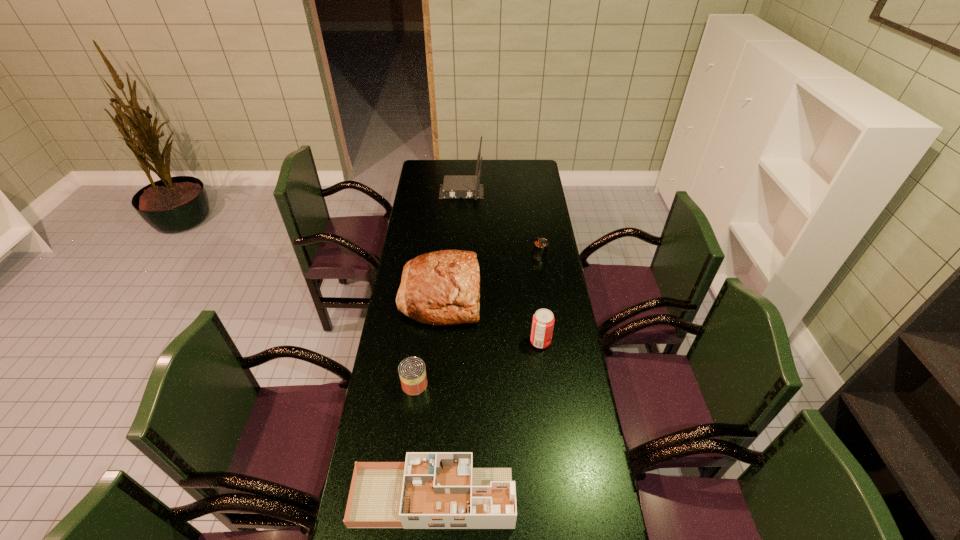
Where is `dollhouse that is at the left edge`? dollhouse that is at the left edge is located at coordinates (431, 490).

Identify the location of can present at the left edge. (412, 372).

Where is `soda can that is positioned at the right edge`? soda can that is positioned at the right edge is located at coordinates (543, 320).

The image size is (960, 540). Identify the location of can situated at the right edge. (540, 249).

I want to click on object present at the far left corner, so click(468, 187).

Find the location of a particular element. This screenshot has width=960, height=540. vacant area at the left edge of the desktop is located at coordinates (406, 260).

You are a GUI agent. You are given a task and a screenshot of the screen. Output one action in this format:
    pyautogui.click(x=<x>, y=<y>)
    Task: Click on the vacant space at the right edge
    The width and height of the screenshot is (960, 540).
    Given the screenshot: What is the action you would take?
    pyautogui.click(x=531, y=190)

You are a GUI agent. You are given a task and a screenshot of the screen. Output one action in this format:
    pyautogui.click(x=<x>, y=<y>)
    Task: Click on the vacant space at the far left corner of the desktop
    This screenshot has height=540, width=960.
    Given the screenshot: What is the action you would take?
    pyautogui.click(x=433, y=171)

Identify the location of free space between the farthest object and the fifth shortest object. This screenshot has width=960, height=540. (451, 243).

Locate an element on the screen. empty location between the bread and the fourth shortest object is located at coordinates [x=491, y=318].